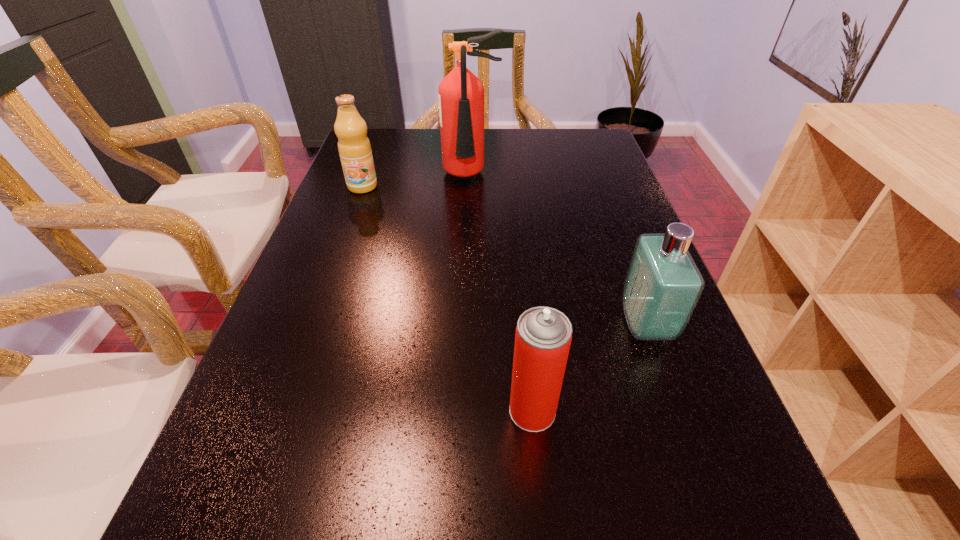
Identify which object is the closest to the nearest object. Please provide its 2D coordinates. Your answer should be formatted as a tuple, i.e. [(x, y)], where the tuple contains the x and y coordinates of a point satisfying the conditions above.

[(663, 284)]

Find the location of a particular element. free region that satisfies the following two spatial constraints: 1. at the nozzle of the fire extinguisher; 2. on the right side of the aerosol can is located at coordinates (464, 411).

What are the coordinates of `vacant space that satisfies the following two spatial constraints: 1. on the front label of the third farthest object; 2. on the front side of the aerosol can` in the screenshot? It's located at (676, 411).

Find the location of a particular element. The width and height of the screenshot is (960, 540). blank space that satisfies the following two spatial constraints: 1. on the front label of the rightmost object; 2. on the front side of the aerosol can is located at coordinates (676, 411).

Locate an element on the screen. This screenshot has width=960, height=540. vacant space that satisfies the following two spatial constraints: 1. on the front label of the perfume; 2. on the front side of the nearest object is located at coordinates (676, 411).

This screenshot has height=540, width=960. Find the location of `vacant space that satisfies the following two spatial constraints: 1. on the front label of the leftmost object; 2. on the right side of the aerosol can`. vacant space that satisfies the following two spatial constraints: 1. on the front label of the leftmost object; 2. on the right side of the aerosol can is located at coordinates (280, 411).

This screenshot has width=960, height=540. I want to click on vacant area that satisfies the following two spatial constraints: 1. on the front label of the aerosol can; 2. on the right side of the leftmost object, so click(x=280, y=411).

At what (x,y) coordinates should I click in order to perform the action: click on vacant space that satisfies the following two spatial constraints: 1. at the nozzle of the aerosol can; 2. on the right side of the fire extinguisher. Please return your answer as a coordinate pair (x, y). This screenshot has height=540, width=960. Looking at the image, I should click on (464, 411).